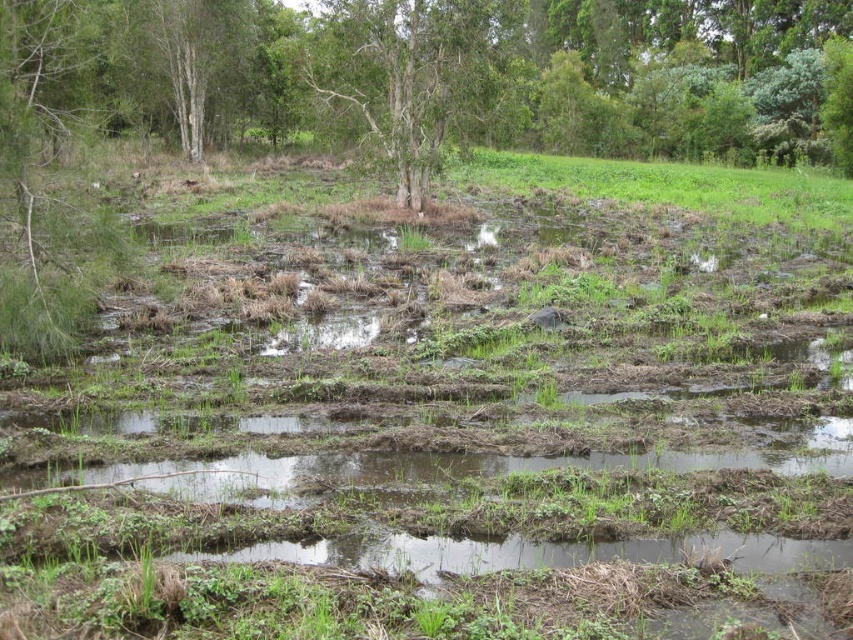
Who is shorter, green matte tree at center or green matte tree at left?

Standing shorter between the two is green matte tree at left.

Who is more forward, (352, 84) or (32, 70)?

Positioned in front is point (32, 70).

Which is behind, point (527, 67) or point (4, 230)?

Point (527, 67)

You are a GUI agent. You are given a task and a screenshot of the screen. Output one action in this format:
    pyautogui.click(x=<x>, y=<y>)
    Task: Click on the green matte tree at center
    Image resolution: width=853 pixels, height=640 pixels.
    Given the screenshot: What is the action you would take?
    coord(380,92)

Does green matte tree at center lie behind green leafy tree at center?

No, it is not.

Is the position of green matte tree at center less distant than that of green leafy tree at center?

Yes, it is.

Where is `green matte tree at center`? green matte tree at center is located at coordinates click(380, 92).

The height and width of the screenshot is (640, 853). In order to click on green matte tree at center in this screenshot , I will do `click(380, 92)`.

Measure the distance between green matte tree at left and green leafy tree at center.

green matte tree at left is 19.84 meters away from green leafy tree at center.

Who is positioned more to the right, green matte tree at left or green leafy tree at center?

Positioned to the right is green leafy tree at center.

Is point (70, 16) farther from viewer compared to point (407, 106)?

That is False.

The width and height of the screenshot is (853, 640). What are the coordinates of `green matte tree at left` in the screenshot? It's located at (45, 184).